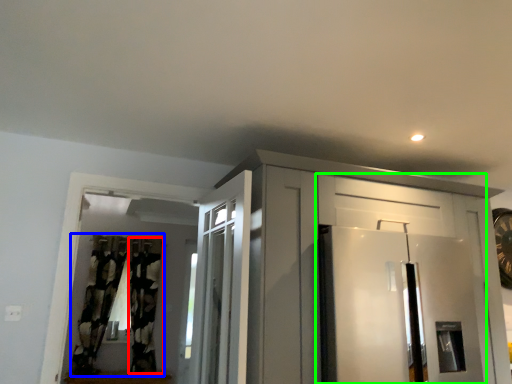
Question: Which is nearer to the curtain (highlighted by a red box)? curtain (highlighted by a blue box) or door (highlighted by a green box).

Choices:
 (A) curtain
 (B) door

Answer: (A)